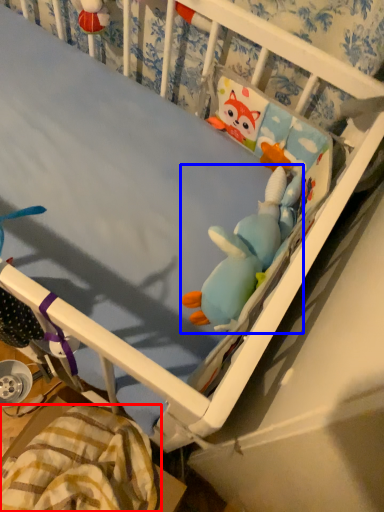
Question: Which object appears closest to the camera in this image, blanket (highlighted by a red box) or toy (highlighted by a blue box)?

Choices:
 (A) blanket
 (B) toy

Answer: (B)